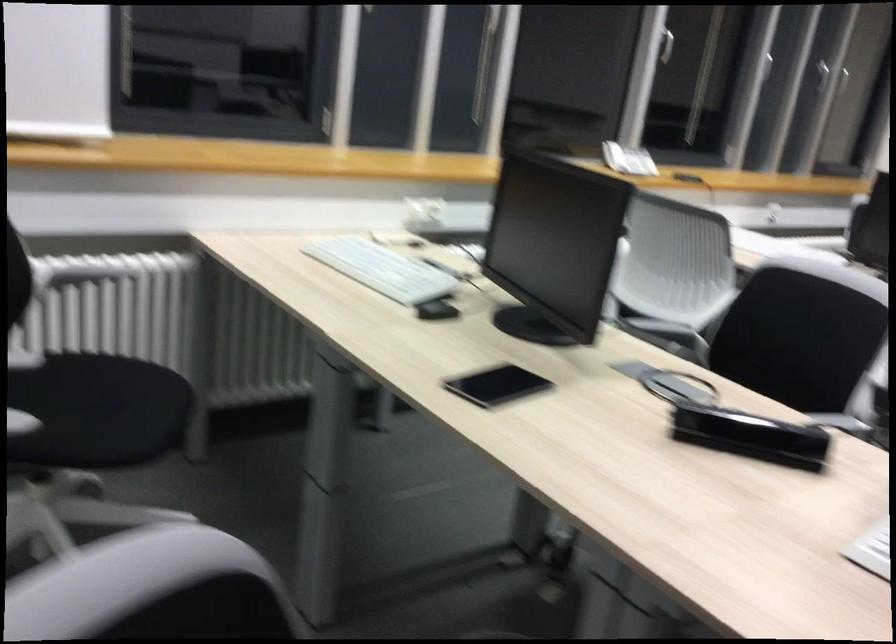
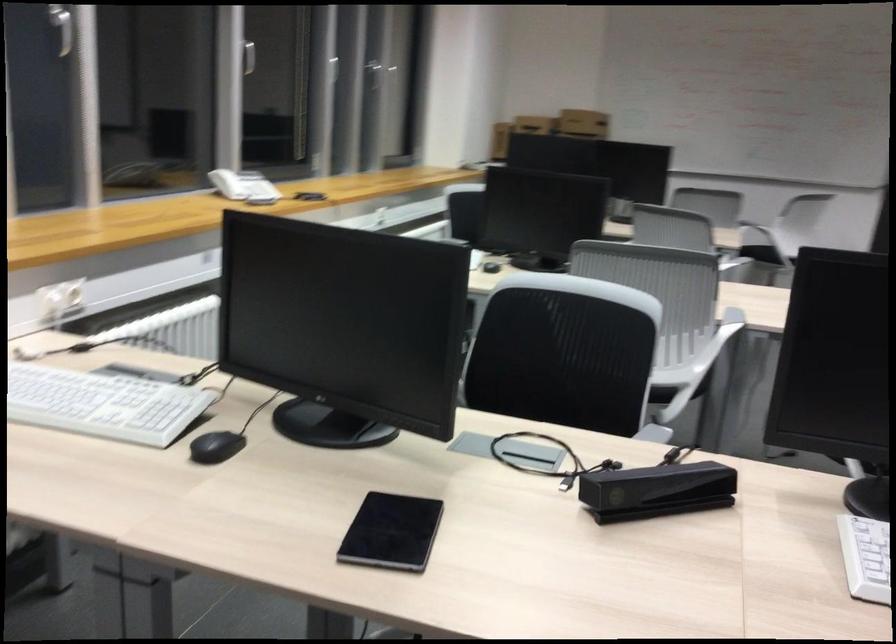
Question: The camera is either moving clockwise (left) or counter-clockwise (right) around the object. The first image is from the beginning of the video and the second image is from the end. Is the camera moving left or right when shooting the video?

Choices:
 (A) Left
 (B) Right

Answer: (A)